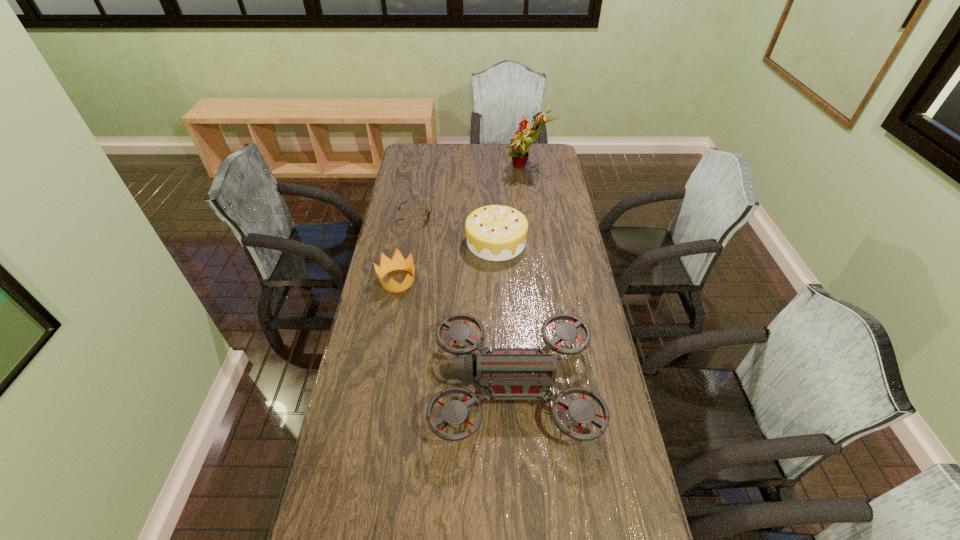
Find the location of a particular element. vacant area that lies between the nearest object and the birthday cake is located at coordinates (505, 314).

Locate an element on the screen. free space between the shortest object and the birthday cake is located at coordinates (455, 229).

Identify the location of object that is the third closest to the sunglasses. The width and height of the screenshot is (960, 540). (519, 144).

Image resolution: width=960 pixels, height=540 pixels. Find the location of `object that stands as the closest to the drone`. object that stands as the closest to the drone is located at coordinates (398, 262).